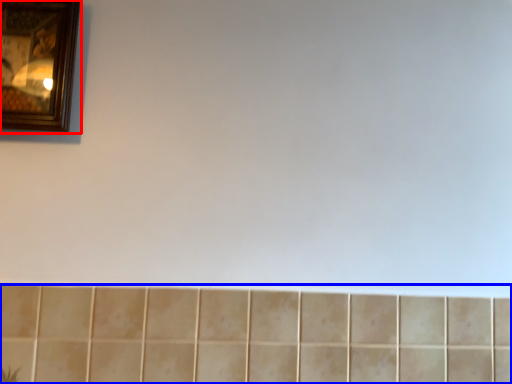
Question: Among these objects, which one is farthest to the camera, picture frame (highlighted by a red box) or ceramic tile (highlighted by a blue box)?

Choices:
 (A) picture frame
 (B) ceramic tile

Answer: (A)